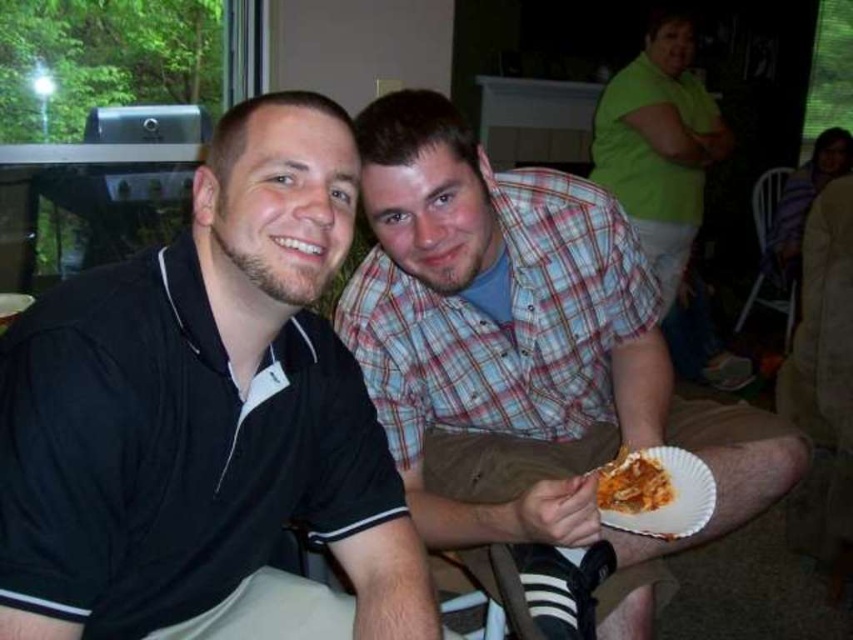
You are standing in front of the two people in the image. The black matte shirt at left is located at coordinates point 0.656, 0.244. If you want to greet them politely, which direction should you face first?

You should face the black matte shirt at left first since it is located at point (207,419), which is on the left side of the image.

You are standing in the room and want to take a photo of the black matte shirt at left. Where should you aim your camera to capture it?

You should aim your camera at point (207, 419) to capture the black matte shirt at left.